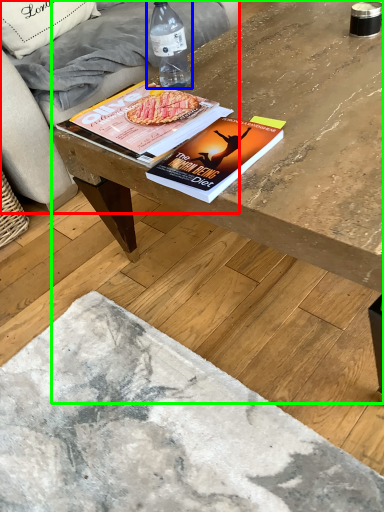
Question: Which object is the farthest from studio couch (highlighted by a red box)? Choose among these: bottle (highlighted by a blue box) or coffee table (highlighted by a green box).

Choices:
 (A) bottle
 (B) coffee table

Answer: (B)